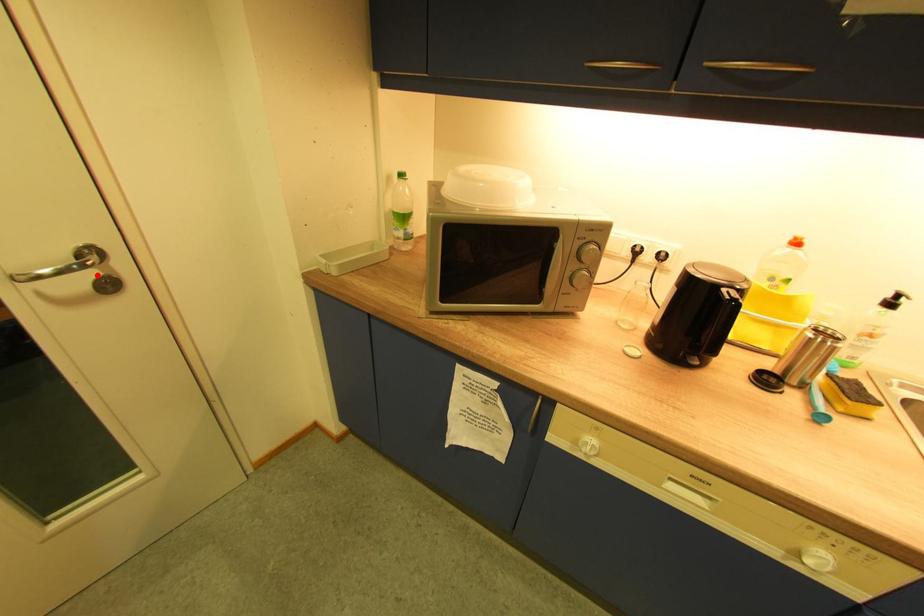
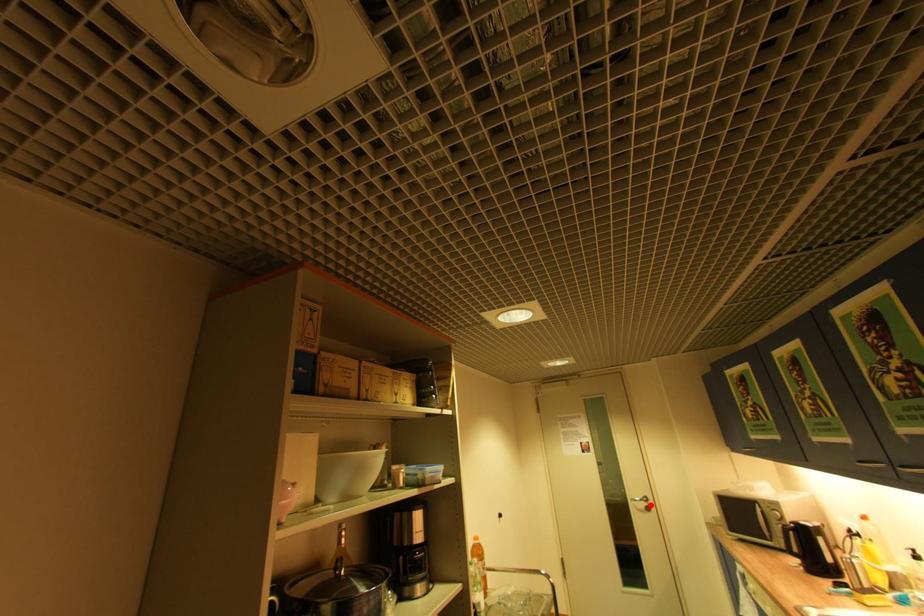
I am providing you with two images of the same scene from different viewpoints. A red point is marked on the first image and another point is marked on the second image. Is the marked point in image1 the same physical position as the marked point in image2?

Yes